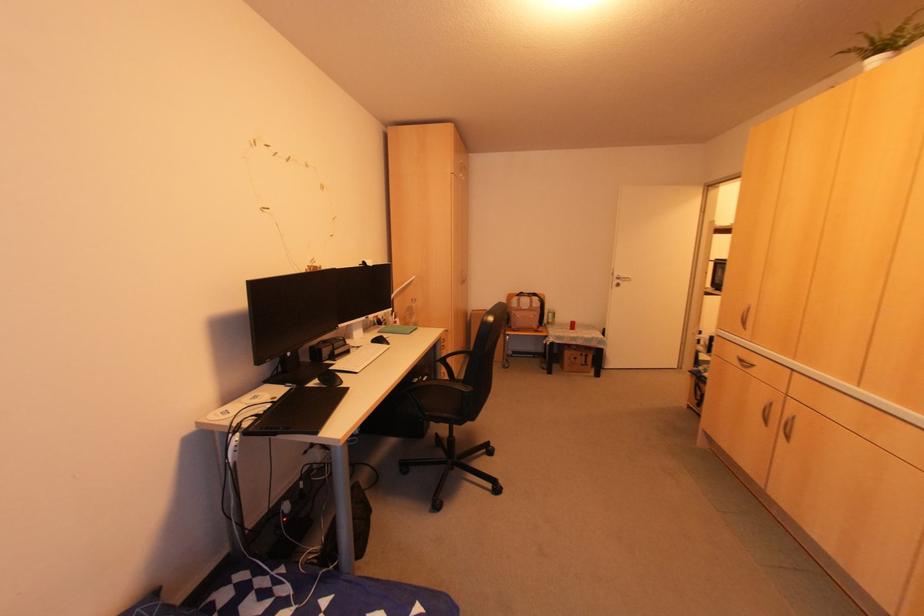
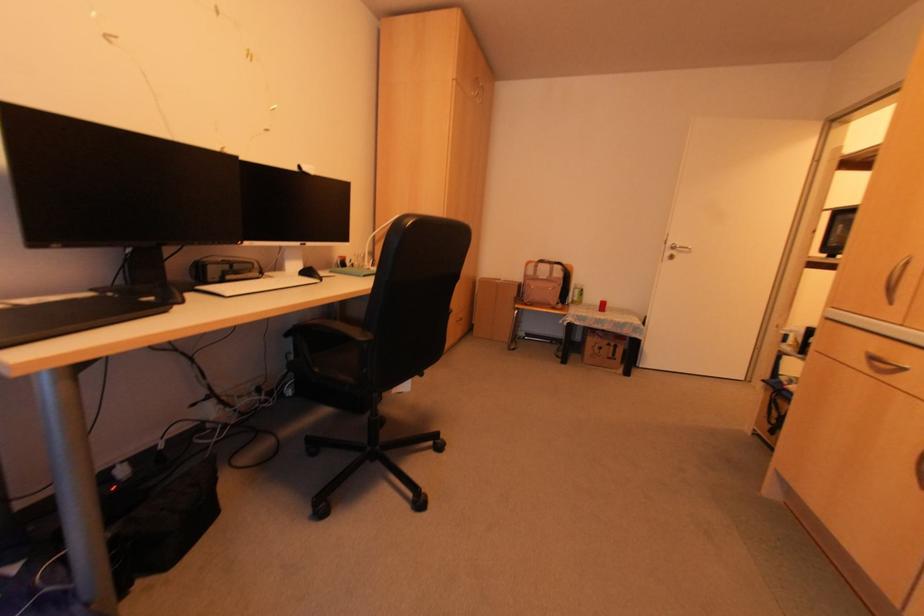
Where in the second image is the point corresponding to (525,309) from the first image?

(542, 278)